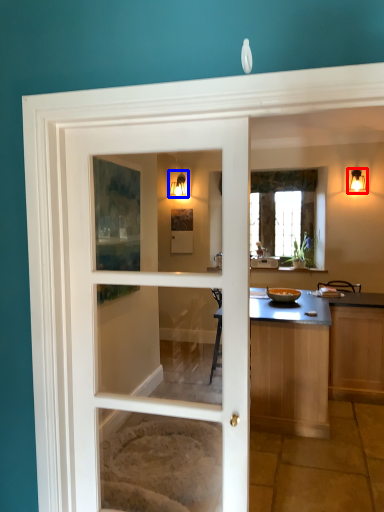
Question: Which point is further to the camera, light fixture (highlighted by a red box) or light fixture (highlighted by a blue box)?

Choices:
 (A) light fixture
 (B) light fixture

Answer: (B)